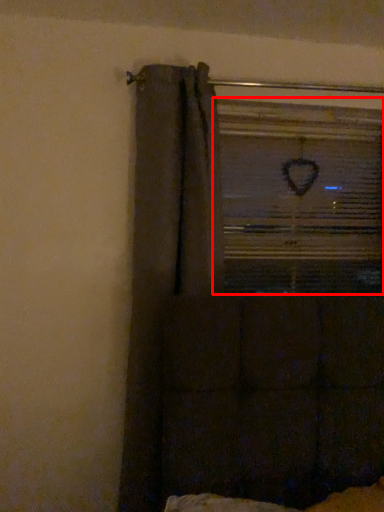
Question: Observing the image, what is the correct spatial positioning of window frame (annotated by the red box) in reference to curtain?

Choices:
 (A) left
 (B) right

Answer: (B)